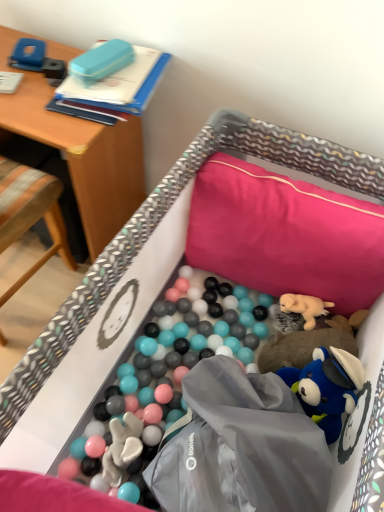
Question: From a real-world perspective, is wooden desk at upper left physically located above or below soft plush dog at center-right?

Choices:
 (A) above
 (B) below

Answer: (A)

Question: Considering the positions of wooden desk at upper left and soft plush dog at center-right in the image, is wooden desk at upper left wider or thinner than soft plush dog at center-right?

Choices:
 (A) thin
 (B) wide

Answer: (B)

Question: Estimate the real-world distances between objects in this image. Which object is farther from the pink fabric pillow at upper right?

Choices:
 (A) wooden desk at upper left
 (B) wooden chair at left
 (C) soft plush dog at center-right

Answer: (B)

Question: Based on their relative distances, which object is nearer to the wooden chair at left?

Choices:
 (A) wooden desk at upper left
 (B) pink fabric pillow at upper right
 (C) soft plush dog at center-right

Answer: (A)